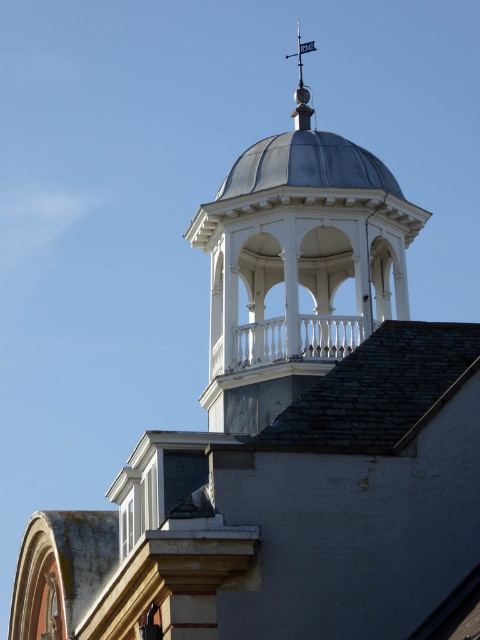
Question: Can you confirm if white wood bell tower at upper center is positioned above gray slate roof at upper center?

Choices:
 (A) yes
 (B) no

Answer: (A)

Question: In this image, where is white wood bell tower at upper center located relative to gray slate roof at upper center?

Choices:
 (A) left
 (B) right

Answer: (A)

Question: Does gray slate roof at upper center have a larger size compared to polished silver spire at upper center?

Choices:
 (A) yes
 (B) no

Answer: (B)

Question: Which of the following is the closest to the observer?

Choices:
 (A) polished silver spire at upper center
 (B) gray slate roof at upper center
 (C) white wood bell tower at upper center

Answer: (B)

Question: Which is nearer to the gray slate roof at upper center?

Choices:
 (A) polished silver spire at upper center
 (B) white wood bell tower at upper center

Answer: (B)

Question: Which of the following is the closest to the observer?

Choices:
 (A) gray slate roof at upper center
 (B) polished silver spire at upper center

Answer: (A)